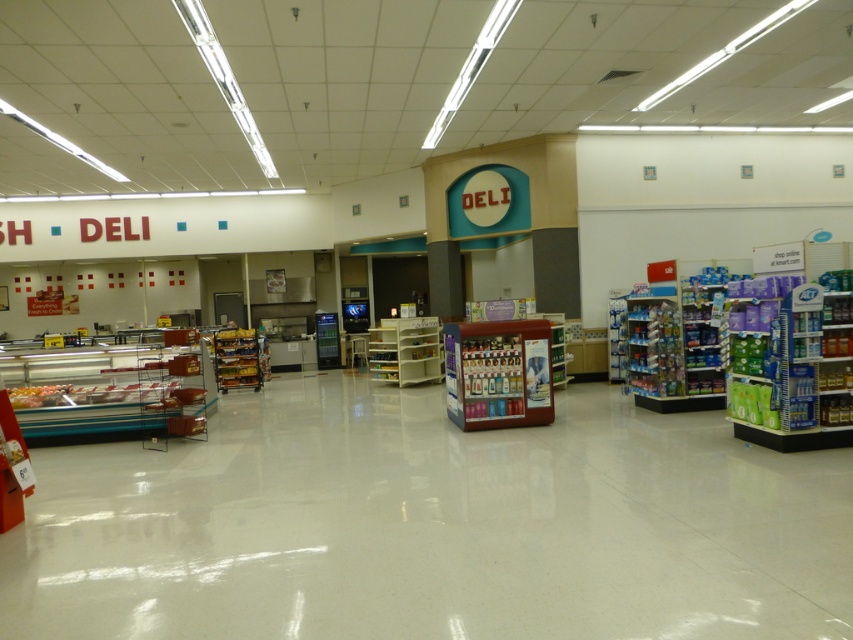
You are standing in the retail store and want to get a drink from the metallic red beverage cooler at center. You notice a point marked at coordinates (x=498, y=372). Where is this point located?

The point at coordinates (x=498, y=372) is located on the metallic red beverage cooler at center.

From the picture: You are a customer in the store and want to place a large deli platter on the surface. Which object between the white glossy floor at center and the wooden shelf at center would be more suitable for placing the platter?

The white glossy floor at center has a larger size compared to the wooden shelf at center, so it would be more suitable for placing the large deli platter.

In the scene shown: You are standing in the retail store and want to grab a cold drink. Where is the metallic red beverage cooler at center located?

The metallic red beverage cooler at center is located at point (498, 372).